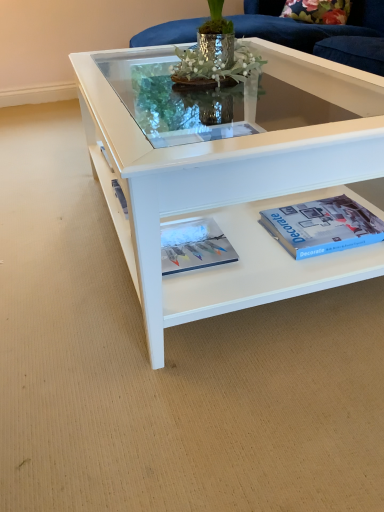
Question: Is matte white magazine at center aimed at blue matte paperback book at lower right?

Choices:
 (A) yes
 (B) no

Answer: (B)

Question: From a real-world perspective, is matte white magazine at center over blue matte paperback book at lower right?

Choices:
 (A) no
 (B) yes

Answer: (A)

Question: Does matte white magazine at center have a lesser width compared to blue matte paperback book at lower right?

Choices:
 (A) yes
 (B) no

Answer: (A)

Question: Is matte white magazine at center at the right side of blue matte paperback book at lower right?

Choices:
 (A) no
 (B) yes

Answer: (A)

Question: Are matte white magazine at center and blue matte paperback book at lower right beside each other?

Choices:
 (A) no
 (B) yes

Answer: (A)

Question: From a real-world perspective, is matte white magazine at center above or below blue matte paperback book at lower right?

Choices:
 (A) below
 (B) above

Answer: (A)

Question: From the image's perspective, is matte white magazine at center positioned above or below blue matte paperback book at lower right?

Choices:
 (A) below
 (B) above

Answer: (A)

Question: Is matte white magazine at center spatially inside blue matte paperback book at lower right, or outside of it?

Choices:
 (A) inside
 (B) outside

Answer: (B)

Question: Considering the positions of matte white magazine at center and blue matte paperback book at lower right in the image, is matte white magazine at center bigger or smaller than blue matte paperback book at lower right?

Choices:
 (A) big
 (B) small

Answer: (B)

Question: From the image's perspective, is white glossy coffee table at center above or below blue matte paperback book at lower right?

Choices:
 (A) below
 (B) above

Answer: (B)

Question: Is white glossy coffee table at center inside or outside of blue matte paperback book at lower right?

Choices:
 (A) inside
 (B) outside

Answer: (B)

Question: In terms of height, does white glossy coffee table at center look taller or shorter compared to blue matte paperback book at lower right?

Choices:
 (A) short
 (B) tall

Answer: (B)

Question: From a real-world perspective, is white glossy coffee table at center positioned above or below blue matte paperback book at lower right?

Choices:
 (A) below
 (B) above

Answer: (B)

Question: Considering the positions of white glossy coffee table at center and matte white magazine at center in the image, is white glossy coffee table at center taller or shorter than matte white magazine at center?

Choices:
 (A) tall
 (B) short

Answer: (A)

Question: Based on their sizes in the image, would you say white glossy coffee table at center is bigger or smaller than matte white magazine at center?

Choices:
 (A) small
 (B) big

Answer: (B)